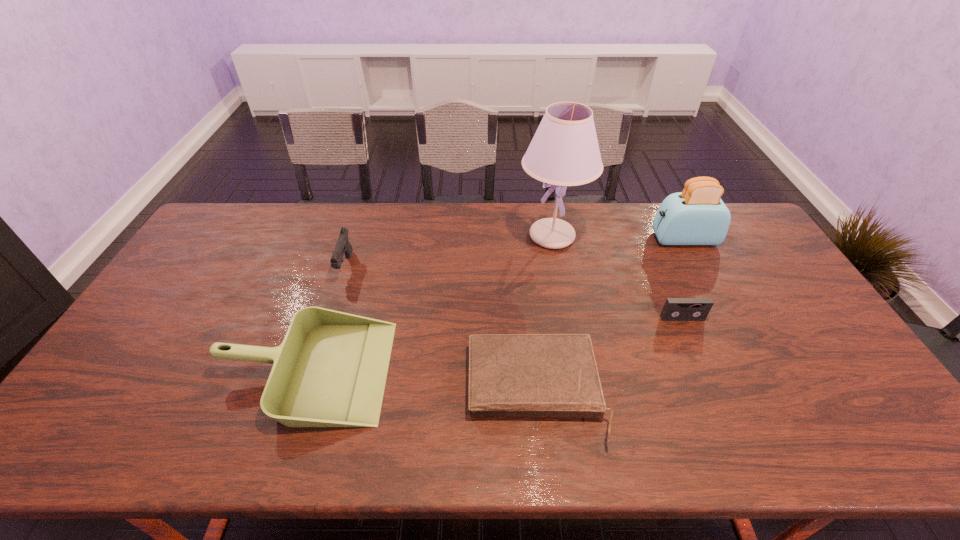
This screenshot has height=540, width=960. Identify the location of free region at the near edge of the desktop. (396, 429).

Locate an element on the screen. The height and width of the screenshot is (540, 960). free region at the left edge of the desktop is located at coordinates (204, 259).

Image resolution: width=960 pixels, height=540 pixels. Identify the location of vacant space at the right edge of the desktop. (759, 284).

You are a GUI agent. You are given a task and a screenshot of the screen. Output one action in this format:
    pyautogui.click(x=<x>, y=<y>)
    Task: Click on the free space between the shortest object and the tallest object
    The image size is (960, 540).
    Given the screenshot: What is the action you would take?
    pyautogui.click(x=543, y=314)

Where is `free space between the paperback book and the videotape`? free space between the paperback book and the videotape is located at coordinates (609, 355).

The width and height of the screenshot is (960, 540). Find the location of `unoccupied position between the dustpan and the tallest object`. unoccupied position between the dustpan and the tallest object is located at coordinates (429, 303).

What are the coordinates of `free space between the toaster and the fifth tallest object` in the screenshot? It's located at (683, 279).

This screenshot has width=960, height=540. What are the coordinates of `blank region between the pistol and the videotape` in the screenshot? It's located at (514, 293).

Identify the location of vacant area that lies between the tallest object and the pistol. Image resolution: width=960 pixels, height=540 pixels. (448, 251).

In order to click on free spot between the paperback book and the toaster in this screenshot , I will do `click(610, 315)`.